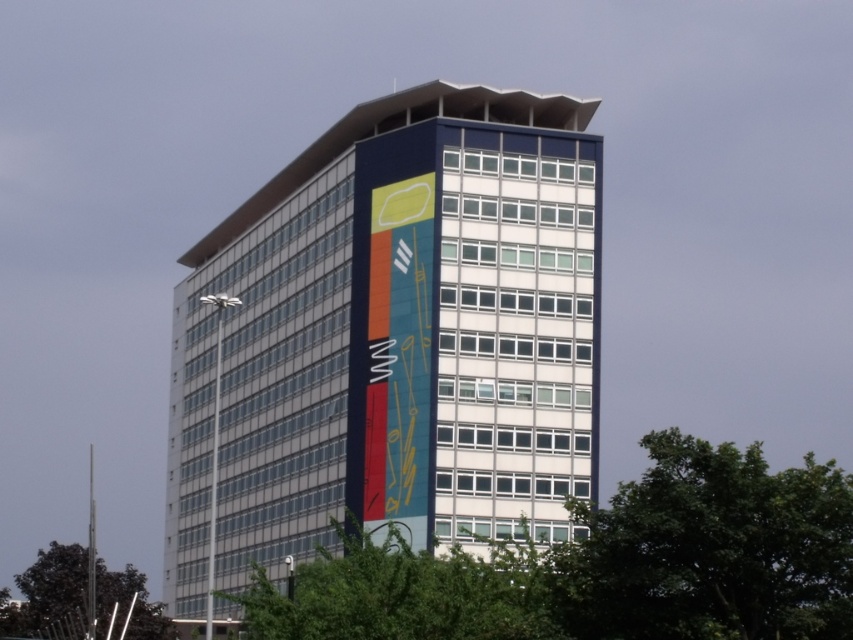
Question: Can you confirm if blue glossy building at center is positioned above green leafy tree at lower right?

Choices:
 (A) yes
 (B) no

Answer: (A)

Question: Estimate the real-world distances between objects in this image. Which object is closer to the green leafy tree at lower right?

Choices:
 (A) green leafy tree at center
 (B) blue glossy building at center

Answer: (A)

Question: Which object is closer to the camera taking this photo?

Choices:
 (A) green leafy tree at lower left
 (B) green leafy tree at center

Answer: (B)

Question: Is green leafy tree at lower right positioned in front of green leafy tree at lower left?

Choices:
 (A) no
 (B) yes

Answer: (B)

Question: Which point is farther to the camera?

Choices:
 (A) click(x=469, y=372)
 (B) click(x=250, y=602)
 (C) click(x=743, y=632)
 (D) click(x=61, y=586)

Answer: (D)

Question: Is green leafy tree at lower right above green leafy tree at center?

Choices:
 (A) yes
 (B) no

Answer: (A)